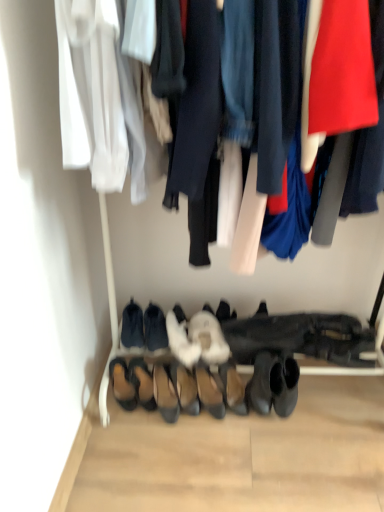
Question: Should I look upward or downward to see black suede shoes at lower center, the 2th footwear when ordered from left to right?

Choices:
 (A) down
 (B) up

Answer: (A)

Question: Is white fuzzy slippers at center, which ranks as the fourth footwear in right-to-left order, oriented away from white fluffy slipper at center, placed as the ninth footwear when sorted from left to right?

Choices:
 (A) yes
 (B) no

Answer: (B)

Question: Is white fuzzy slippers at center, which ranks as the fourth footwear in right-to-left order, closer to camera compared to white fluffy slipper at center, placed as the ninth footwear when sorted from left to right?

Choices:
 (A) yes
 (B) no

Answer: (A)

Question: Considering the relative sizes of white fuzzy slippers at center, which ranks as the fourth footwear in right-to-left order, and white fluffy slipper at center, which appears as the 2th footwear when viewed from the right, in the image provided, is white fuzzy slippers at center, which ranks as the fourth footwear in right-to-left order, taller than white fluffy slipper at center, which appears as the 2th footwear when viewed from the right,?

Choices:
 (A) no
 (B) yes

Answer: (B)

Question: From the image's perspective, is white fuzzy slippers at center, which ranks as the fourth footwear in right-to-left order, under white fluffy slipper at center, placed as the ninth footwear when sorted from left to right?

Choices:
 (A) yes
 (B) no

Answer: (A)

Question: Is white fuzzy slippers at center, which is the seventh footwear in left-to-right order, aimed at white fluffy slipper at center, which appears as the 2th footwear when viewed from the right?

Choices:
 (A) yes
 (B) no

Answer: (B)

Question: Can you confirm if white fuzzy slippers at center, which ranks as the fourth footwear in right-to-left order, is positioned to the left of white fluffy slipper at center, placed as the ninth footwear when sorted from left to right?

Choices:
 (A) yes
 (B) no

Answer: (A)

Question: Is black leather boot at lower center, the 1th footwear when ordered from right to left, far from white fluffy slipper at center, which appears as the 2th footwear when viewed from the right?

Choices:
 (A) no
 (B) yes

Answer: (A)

Question: From a real-world perspective, is black leather boot at lower center, the 1th footwear when ordered from right to left, below white fluffy slipper at center, which appears as the 2th footwear when viewed from the right?

Choices:
 (A) yes
 (B) no

Answer: (A)

Question: Considering the relative positions of black leather boot at lower center, the 1th footwear when ordered from right to left, and white fluffy slipper at center, placed as the ninth footwear when sorted from left to right, in the image provided, is black leather boot at lower center, the 1th footwear when ordered from right to left, to the right of white fluffy slipper at center, placed as the ninth footwear when sorted from left to right, from the viewer's perspective?

Choices:
 (A) yes
 (B) no

Answer: (A)

Question: Is black leather boot at lower center, which appears as the 10th footwear when viewed from the left, shorter than white fluffy slipper at center, placed as the ninth footwear when sorted from left to right?

Choices:
 (A) no
 (B) yes

Answer: (A)

Question: Is black leather boot at lower center, the 1th footwear when ordered from right to left, turned away from white fluffy slipper at center, placed as the ninth footwear when sorted from left to right?

Choices:
 (A) yes
 (B) no

Answer: (B)

Question: Would you say white fluffy slipper at center, which appears as the 2th footwear when viewed from the right, is part of black leather boot at lower center, which appears as the 10th footwear when viewed from the left,'s contents?

Choices:
 (A) yes
 (B) no

Answer: (B)

Question: Is white fluffy slippers at center, the fifth footwear from the right, positioned in front of black suede shoes at lower center, which appears as the 9th footwear when viewed from the right?

Choices:
 (A) yes
 (B) no

Answer: (A)